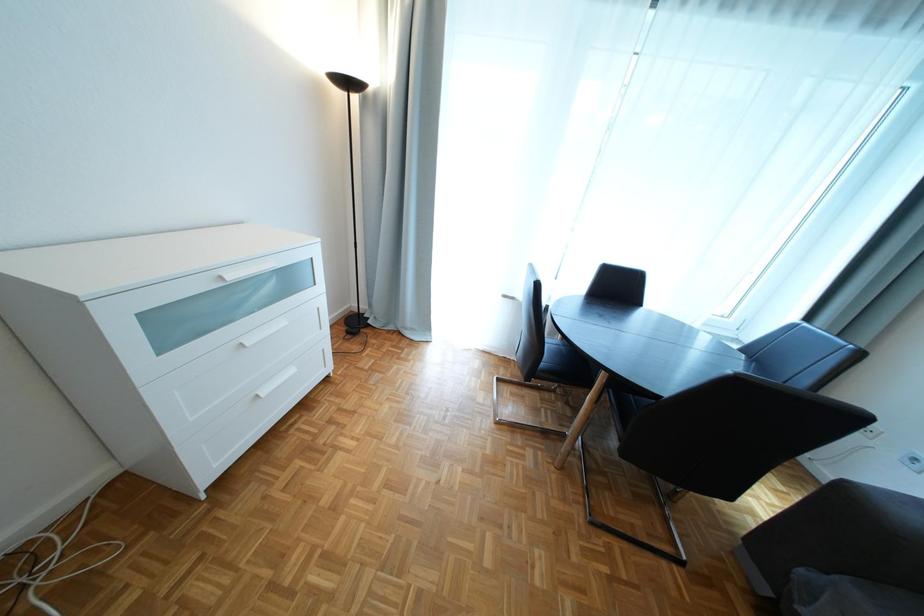
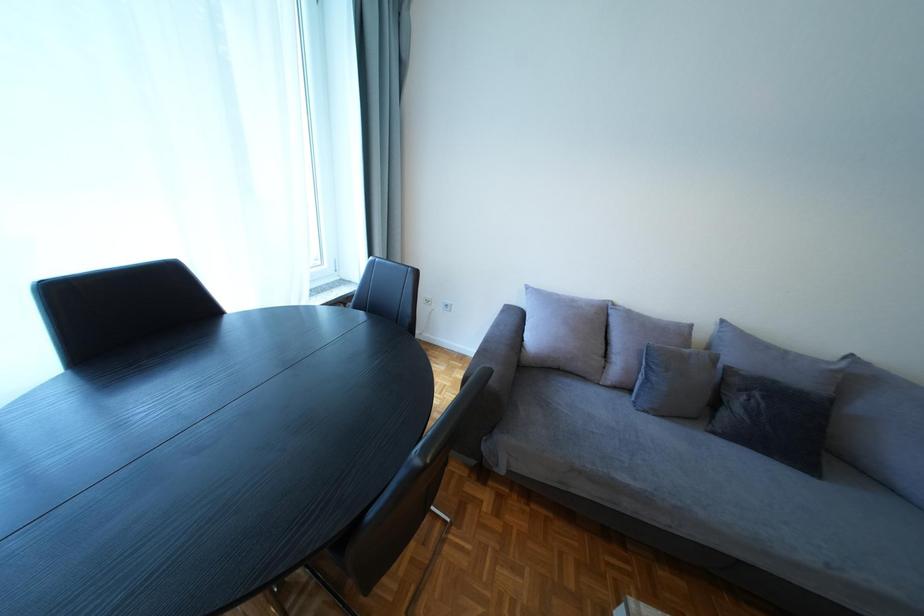
The images are taken continuously from a first-person perspective. In which direction is your viewpoint rotating?

The camera rotated toward right-down.